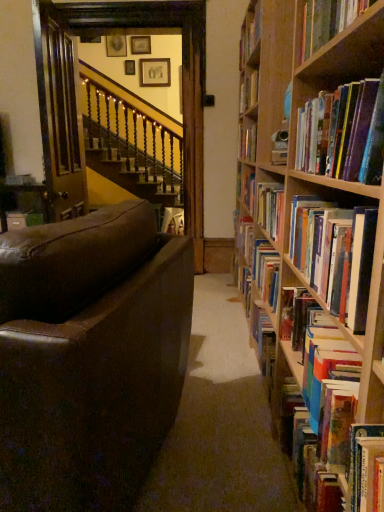
Question: Should I look upward or downward to see wooden picture frame at upper center, the 3th picture frame from the right?

Choices:
 (A) down
 (B) up

Answer: (B)

Question: Is wooden picture frame at upper center, which appears as the 2th picture frame when viewed from the right, wider than wooden picture frame at upper center, the first picture frame in the left-to-right sequence?

Choices:
 (A) no
 (B) yes

Answer: (A)

Question: Is wooden picture frame at upper center, which appears as the 2th picture frame when viewed from the right, far away from wooden picture frame at upper center, the first picture frame in the left-to-right sequence?

Choices:
 (A) no
 (B) yes

Answer: (A)

Question: Would you say wooden picture frame at upper center, which ranks as the second picture frame in left-to-right order, contains wooden picture frame at upper center, the first picture frame in the left-to-right sequence?

Choices:
 (A) no
 (B) yes

Answer: (A)

Question: From a real-world perspective, does wooden picture frame at upper center, which appears as the 2th picture frame when viewed from the right, stand above wooden picture frame at upper center, the first picture frame in the left-to-right sequence?

Choices:
 (A) yes
 (B) no

Answer: (A)

Question: Can you confirm if wooden picture frame at upper center, which ranks as the second picture frame in left-to-right order, is smaller than wooden picture frame at upper center, the 3th picture frame from the right?

Choices:
 (A) yes
 (B) no

Answer: (A)

Question: Can you confirm if wooden picture frame at upper center, which appears as the 2th picture frame when viewed from the right, is thinner than wooden picture frame at upper center, the 3th picture frame from the right?

Choices:
 (A) yes
 (B) no

Answer: (A)

Question: Can you confirm if hardcover book at center, the second book when ordered from back to front, is taller than hardcover book at upper right, arranged as the 2th book when viewed from the front?

Choices:
 (A) no
 (B) yes

Answer: (B)

Question: Is hardcover book at center, marked as the fifth book in a front-to-back arrangement, to the right of hardcover book at upper right, the 5th book when ordered from back to front, from the viewer's perspective?

Choices:
 (A) yes
 (B) no

Answer: (A)

Question: From the image's perspective, is hardcover book at center, marked as the fifth book in a front-to-back arrangement, under hardcover book at upper right, the 5th book when ordered from back to front?

Choices:
 (A) no
 (B) yes

Answer: (B)

Question: From a real-world perspective, is hardcover book at center, marked as the fifth book in a front-to-back arrangement, physically above hardcover book at upper right, the 5th book when ordered from back to front?

Choices:
 (A) no
 (B) yes

Answer: (A)

Question: Is hardcover book at center, marked as the fifth book in a front-to-back arrangement, in contact with hardcover book at upper right, the 5th book when ordered from back to front?

Choices:
 (A) no
 (B) yes

Answer: (A)

Question: Is hardcover book at center, marked as the fifth book in a front-to-back arrangement, facing towards hardcover book at upper right, the 5th book when ordered from back to front?

Choices:
 (A) no
 (B) yes

Answer: (A)

Question: Considering the relative positions of wooden picture frame at upper center, the 3th picture frame viewed from the left, and hardcover book at right, which ranks as the fourth book in front-to-back order, in the image provided, is wooden picture frame at upper center, the 3th picture frame viewed from the left, to the left of hardcover book at right, which ranks as the fourth book in front-to-back order, from the viewer's perspective?

Choices:
 (A) no
 (B) yes

Answer: (B)